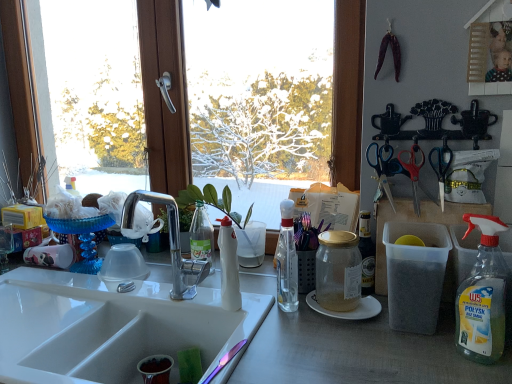
Identify the location of unoccupied space behind satin nickel faucet at sink center. (158, 295).